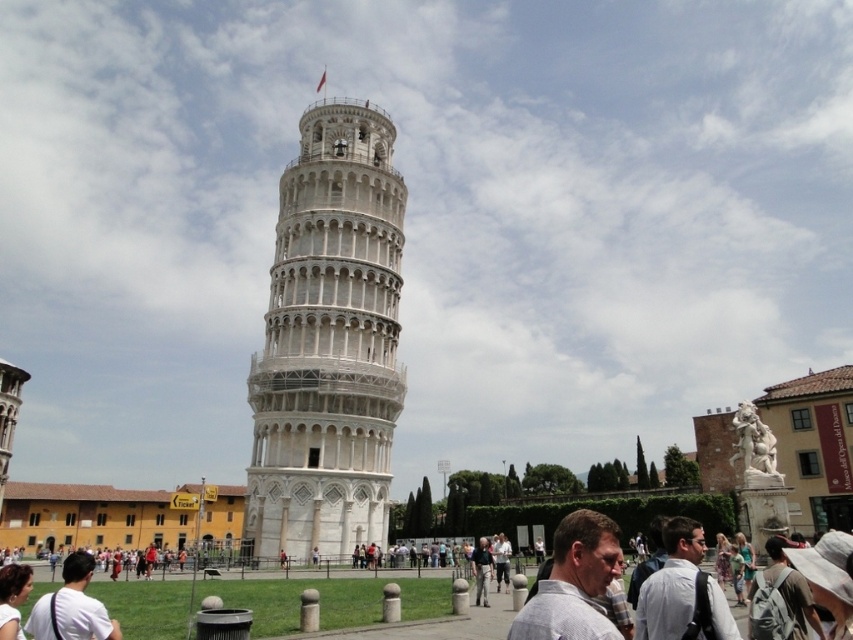
You are a tourist visiting the Leaning Tower of Pisa and you want to take a photo with both the light brown backpack at center and the floral dress at center in the background. Which object should be placed closer to the camera to ensure both appear in the frame?

The light brown backpack at center is much taller than the floral dress at center, so placing the backpack closer to the camera will allow both to be in the frame while accounting for their size difference.

Based on the photo, you are standing in front of the Leaning Tower of Pisa and want to place a souvenir on the light brown backpack at center. Given that the tower is leaning to its right, which direction should you move relative to the tower to reach the backpack?

The light brown backpack at center is located at point coordinates, so you should move towards the center of the scene relative to the tower to reach the backpack.